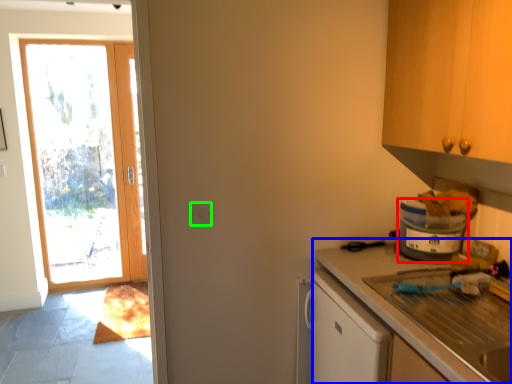
Question: Which object is positioned farthest from appliance (highlighted by a red box)? Select from countertop (highlighted by a blue box) and electric outlet (highlighted by a green box).

Choices:
 (A) countertop
 (B) electric outlet

Answer: (B)